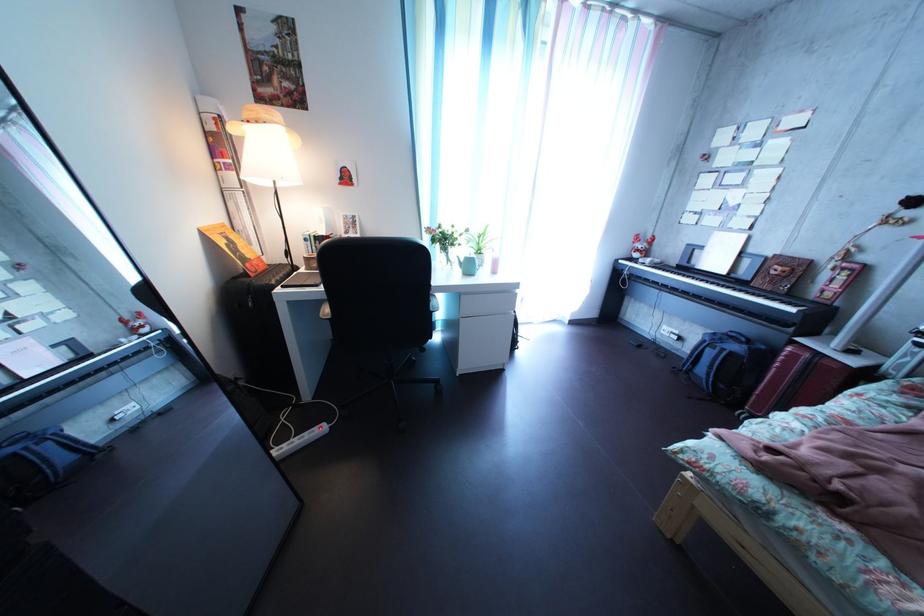
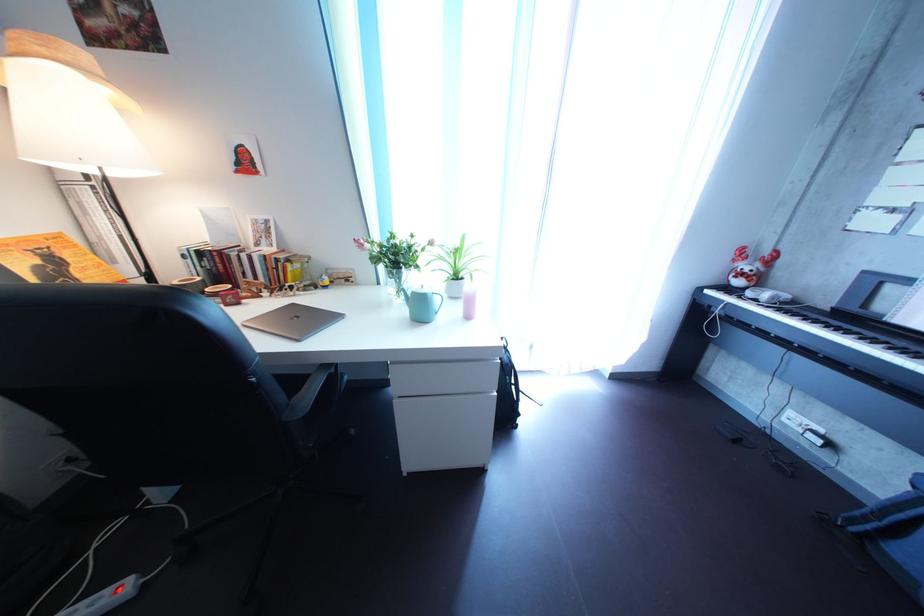
Find the pixel in the second image that matches (x=330, y=436) in the first image.

(122, 601)